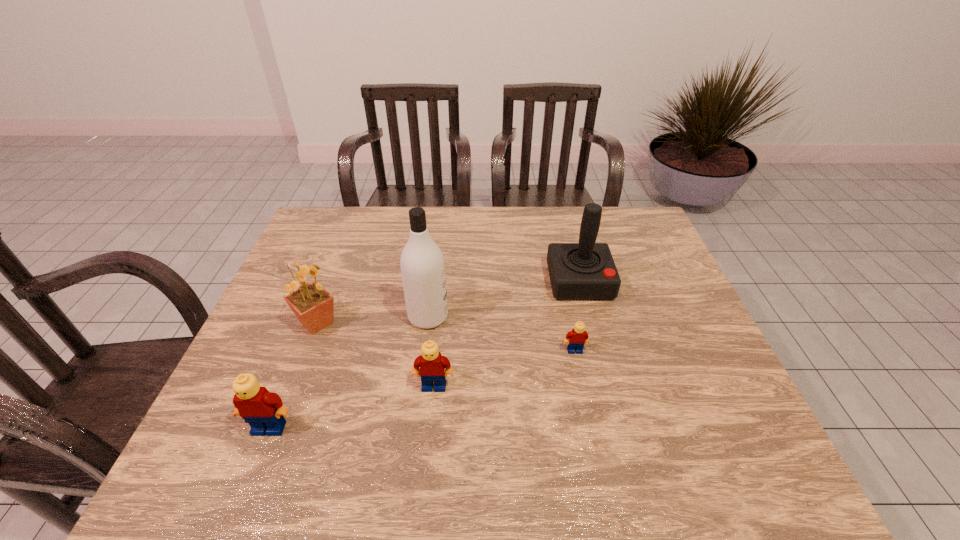
At what (x,y) coordinates should I click in order to perform the action: click on empty space that is in between the joystick and the sunflower. Please return your answer as a coordinate pair (x, y). Looking at the image, I should click on (448, 302).

The image size is (960, 540). Identify the location of free spot between the shampoo and the nearest Lego. (348, 372).

Image resolution: width=960 pixels, height=540 pixels. I want to click on free area in between the joystick and the shortest object, so click(577, 316).

At what (x,y) coordinates should I click in order to perform the action: click on object that is the third closest to the fourth farthest object. Please return your answer as a coordinate pair (x, y). Looking at the image, I should click on (422, 264).

Identify the location of the closest object to the tallest object. This screenshot has width=960, height=540. (432, 364).

You are a GUI agent. You are given a task and a screenshot of the screen. Output one action in this format:
    pyautogui.click(x=<x>, y=<y>)
    Task: Click on the Lego that is the third closest to the joystick
    The width and height of the screenshot is (960, 540).
    Given the screenshot: What is the action you would take?
    pyautogui.click(x=264, y=411)

Select which Lego appears as the closest to the fifth tallest object. Please provide its 2D coordinates. Your answer should be formatted as a tuple, i.e. [(x, y)], where the tuple contains the x and y coordinates of a point satisfying the conditions above.

[(264, 411)]

This screenshot has width=960, height=540. Identify the location of free space that satisfies the following two spatial constraints: 1. at the front of the sunflower with flowers visible; 2. on the front-facing side of the nearest Lego. (277, 428).

Locate an element on the screen. This screenshot has height=540, width=960. vacant area in the image that satisfies the following two spatial constraints: 1. on the front-facing side of the tallest object; 2. on the front-facing side of the nearest Lego is located at coordinates 415,428.